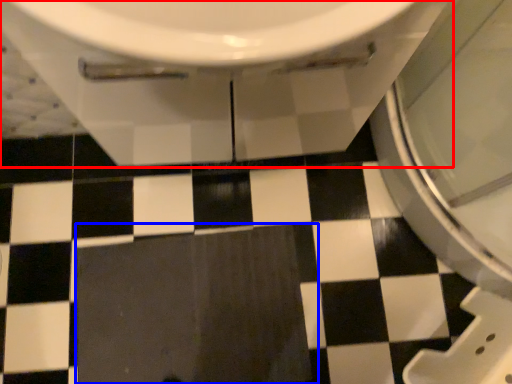
Question: Which of the following is the farthest to the observer, toilet (highlighted by a red box) or ceramic tile (highlighted by a blue box)?

Choices:
 (A) toilet
 (B) ceramic tile

Answer: (B)